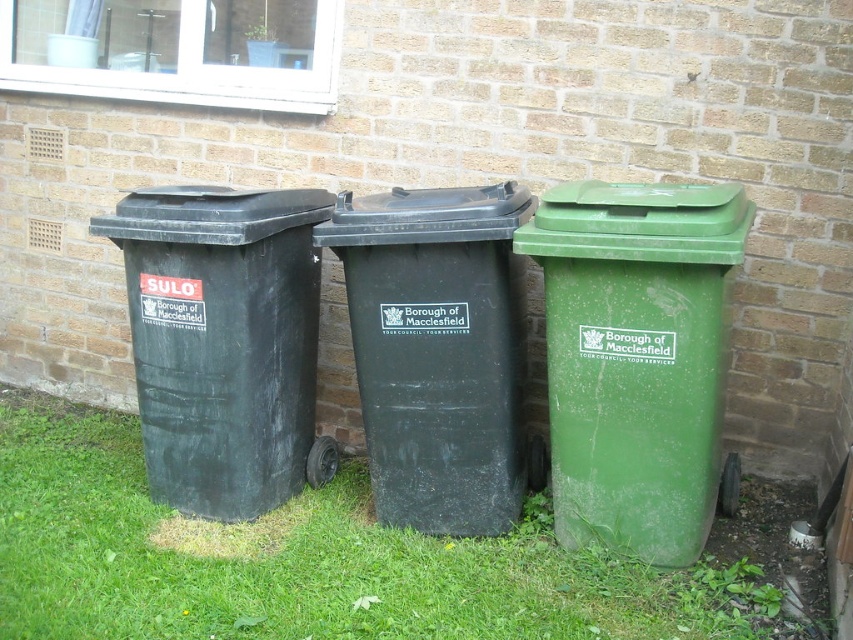
Question: Can you confirm if green grass at lower left is thinner than matte black bin at left?

Choices:
 (A) no
 (B) yes

Answer: (A)

Question: Among these points, which one is nearest to the camera?

Choices:
 (A) (544, 515)
 (B) (635, 355)
 (C) (372, 246)
 (D) (178, 272)

Answer: (B)

Question: Which point appears closest to the camera in this image?

Choices:
 (A) (601, 410)
 (B) (138, 236)
 (C) (599, 419)
 (D) (805, 561)

Answer: (A)

Question: Is green grass at lower left to the right of matte black bin at left from the viewer's perspective?

Choices:
 (A) yes
 (B) no

Answer: (A)

Question: Can you confirm if green grass at lower left is positioned to the right of green plastic bin at center?

Choices:
 (A) yes
 (B) no

Answer: (B)

Question: Among these points, which one is nearest to the camera?

Choices:
 (A) (213, 241)
 (B) (463, 276)

Answer: (A)